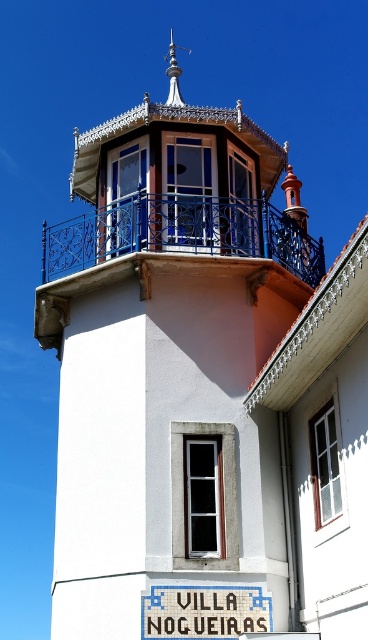
You are standing in front of the building and want to read the white plastic sign at center. Which direction should you turn your head to see the blue wrought iron balcony at upper center?

You should turn your head to the left to see the blue wrought iron balcony at upper center because it is located to the left of the white plastic sign at center.

You are standing at the base of the building shown in the image. You want to locate the blue wrought iron balcony at upper center. Which direction should you look to find it?

You should look upward and toward the center of the building to find the blue wrought iron balcony at upper center, as it is located at point coordinates approximately 0.367 on the horizontal axis and 0.492 on the vertical axis.

You are standing in front of the building and want to locate the point at coordinates point (181, 234). Based on the scene description, where would this point be located?

The point (181, 234) is located on the blue wrought iron balcony at upper center.